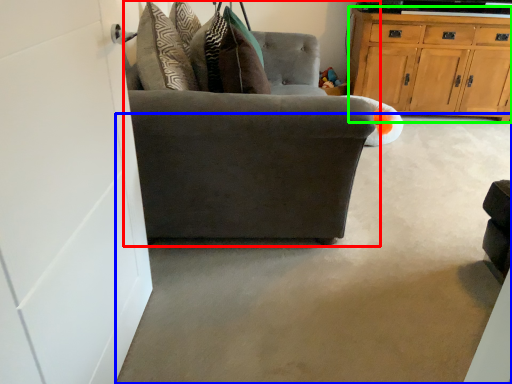
Question: Which object is positioned closest to chair (highlighted by a red box)? Select from concrete (highlighted by a blue box) and cabinetry (highlighted by a green box).

Choices:
 (A) concrete
 (B) cabinetry

Answer: (A)